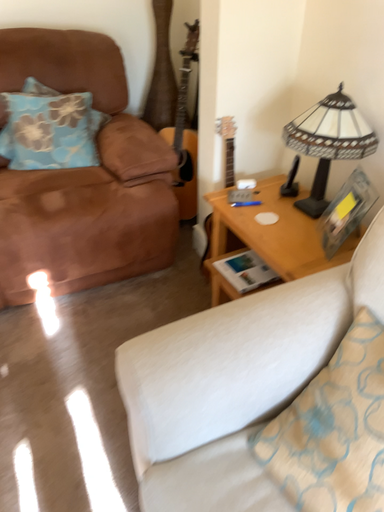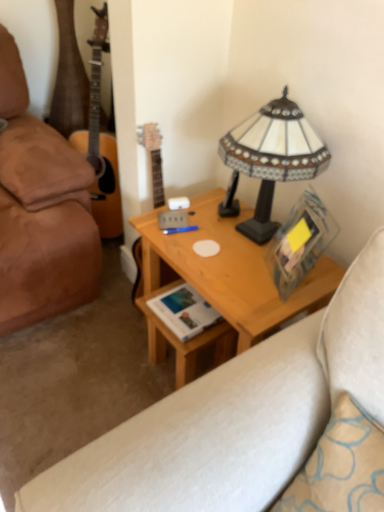
Question: Which way did the camera rotate in the video?

Choices:
 (A) rotated right
 (B) rotated left

Answer: (A)